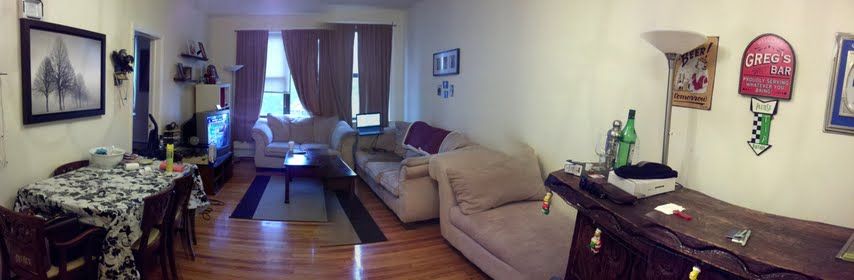
At what (x,y) coordinates should I click in order to perform the action: click on ceiling. Please return your answer as a coordinate pair (x, y). Looking at the image, I should click on (301, 6).